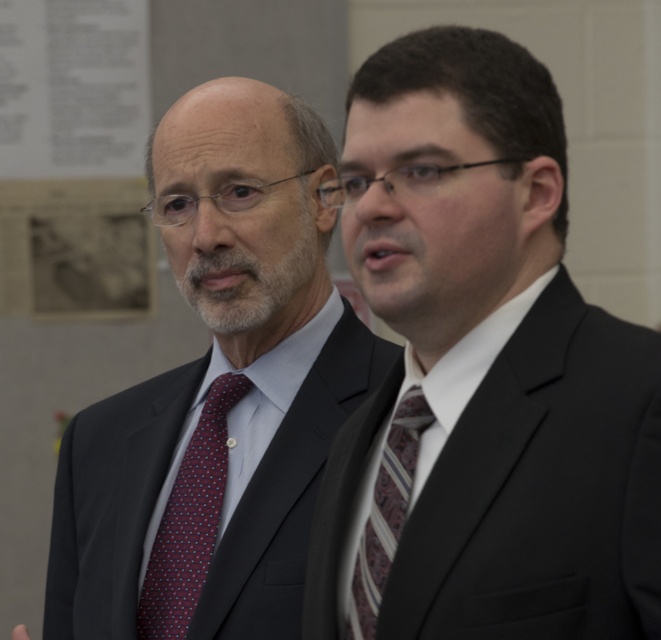
Question: Is matte black suit at left above striped silk tie at right?

Choices:
 (A) yes
 (B) no

Answer: (A)

Question: Which object appears farthest from the camera in this image?

Choices:
 (A) matte black suit at left
 (B) dark red textured tie at left
 (C) dark suit at right
 (D) striped silk tie at right

Answer: (B)

Question: Which point is farther to the camera?

Choices:
 (A) click(208, 508)
 (B) click(436, 74)

Answer: (A)

Question: Can you confirm if dark suit at right is smaller than dark red textured tie at left?

Choices:
 (A) yes
 (B) no

Answer: (B)

Question: Can you confirm if dark suit at right is positioned to the left of striped silk tie at right?

Choices:
 (A) yes
 (B) no

Answer: (B)

Question: Which of these objects is positioned closest to the matte black suit at left?

Choices:
 (A) dark suit at right
 (B) dark red textured tie at left

Answer: (B)